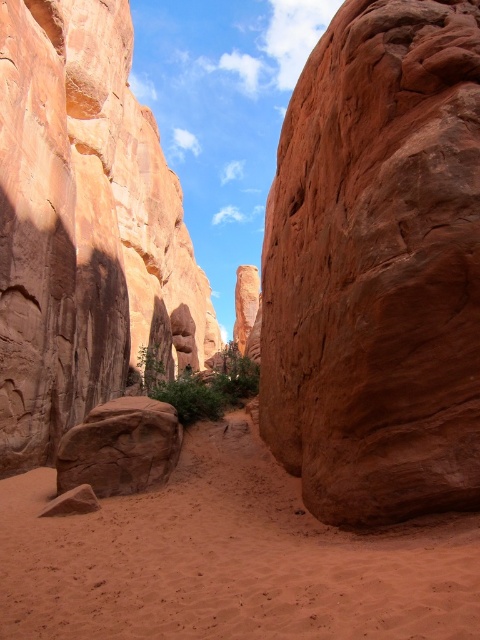
Does smooth sandstone boulder at left appear over sandy/dry sand at center?

Yes, smooth sandstone boulder at left is above sandy/dry sand at center.

Between smooth sandstone boulder at left and sandy/dry sand at center, which one has more height?

With more height is smooth sandstone boulder at left.

You are a GUI agent. You are given a task and a screenshot of the screen. Output one action in this format:
    pyautogui.click(x=<x>, y=<y>)
    Task: Click on the smooth sandstone boulder at left
    The image size is (480, 640).
    Given the screenshot: What is the action you would take?
    pyautogui.click(x=84, y=227)

Identify the location of smooth sandstone boulder at left. (84, 227).

Is point (135, 106) closer to camera compared to point (133, 433)?

No, (135, 106) is behind (133, 433).

Is smooth sandstone boulder at left to the right of rustic sandstone boulder at lower left from the viewer's perspective?

No, smooth sandstone boulder at left is not to the right of rustic sandstone boulder at lower left.

What do you see at coordinates (84, 227) in the screenshot? I see `smooth sandstone boulder at left` at bounding box center [84, 227].

Locate an element on the screen. The width and height of the screenshot is (480, 640). smooth sandstone boulder at left is located at coordinates pos(84,227).

Does point (79, 524) come farther from viewer compared to point (153, 461)?

No, (79, 524) is in front of (153, 461).

Which of these two, sandy/dry sand at center or rustic sandstone boulder at lower left, stands shorter?

With less height is sandy/dry sand at center.

Which is in front, point (20, 545) or point (128, 397)?

Point (20, 545) is in front.

This screenshot has height=640, width=480. I want to click on sandy/dry sand at center, so click(x=228, y=560).